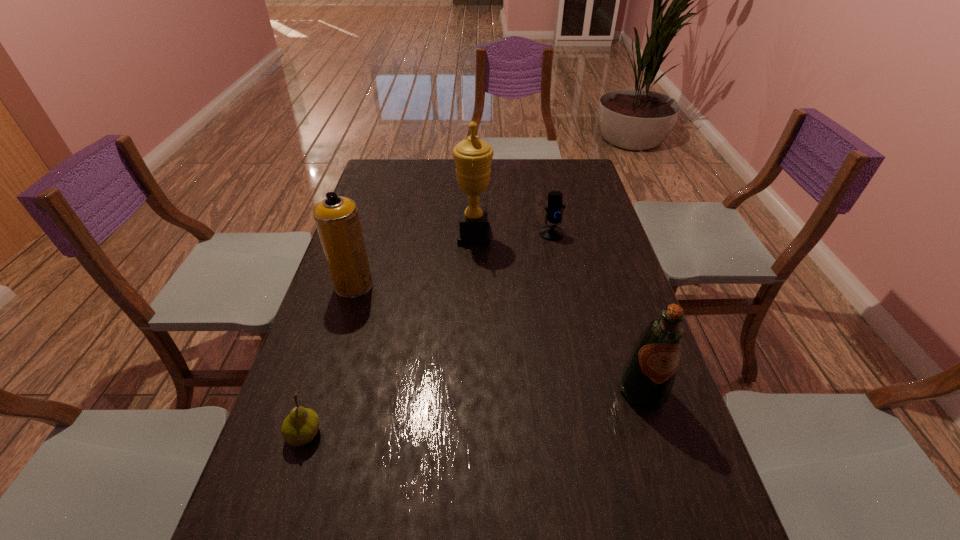
At what (x,y) coordinates should I click in order to perform the action: click on vacant point at the far left corner. Please return your answer as a coordinate pair (x, y). Looking at the image, I should click on (372, 174).

Find the location of a particular element. This screenshot has height=540, width=960. empty space between the third nearest object and the olive oil is located at coordinates (498, 338).

You are a GUI agent. You are given a task and a screenshot of the screen. Output one action in this format:
    pyautogui.click(x=<x>, y=<y>)
    Task: Click on the vacant region between the rightmost object and the second shortest object
    The height and width of the screenshot is (540, 960).
    Given the screenshot: What is the action you would take?
    pyautogui.click(x=597, y=312)

Image resolution: width=960 pixels, height=540 pixels. I want to click on empty space between the olive oil and the tallest object, so click(558, 313).

Identify the location of unoccupied area between the trophy cup and the pear. This screenshot has height=540, width=960. (389, 335).

Identify the location of free space between the fourth object from left to right and the olive oil. (597, 312).

The image size is (960, 540). What are the coordinates of `free space between the rightmost object and the tallest object` in the screenshot? It's located at (558, 313).

Locate an element on the screen. This screenshot has width=960, height=540. empty location between the third nearest object and the microphone is located at coordinates (453, 259).

Identify the location of vacant area that lies between the olive oil and the aerosol can. This screenshot has width=960, height=540. (x=498, y=338).

Find the location of a particular element. The width and height of the screenshot is (960, 540). empty space that is in between the fourth tallest object and the third object from right to left is located at coordinates (513, 234).